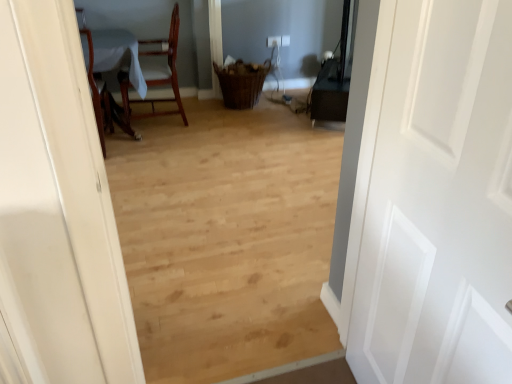
Question: In the image, is mahogany wood chair at upper left positioned in front of or behind wooden table at left?

Choices:
 (A) behind
 (B) front

Answer: (A)

Question: From the image's perspective, relative to wooden table at left, is mahogany wood chair at upper left above or below?

Choices:
 (A) below
 (B) above

Answer: (B)

Question: Which of these objects is positioned farthest from the white matte door at right?

Choices:
 (A) mahogany wood chair at upper left
 (B) wooden table at left

Answer: (A)

Question: Estimate the real-world distances between objects in this image. Which object is closer to the wooden table at left?

Choices:
 (A) white matte door at right
 (B) mahogany wood chair at upper left

Answer: (B)